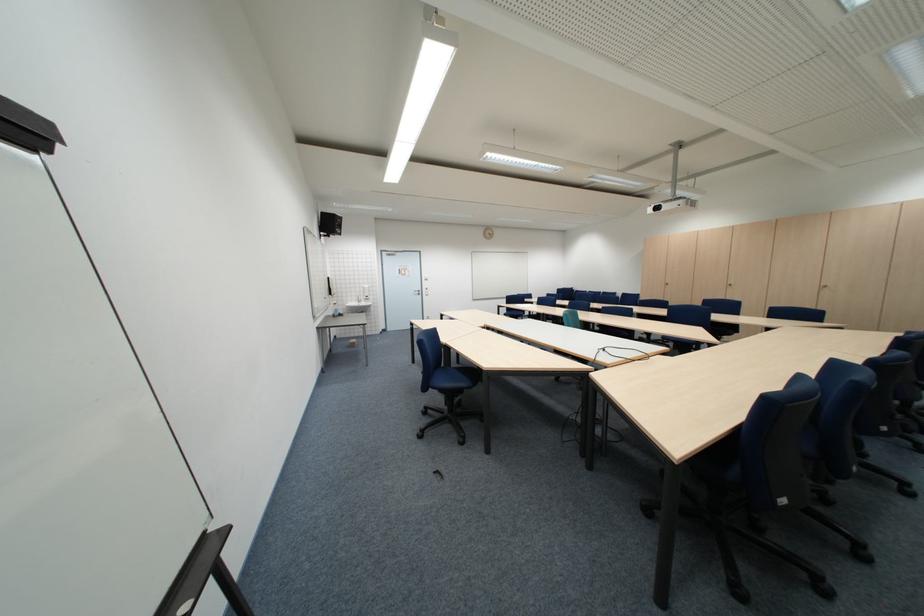
Describe the element at coordinates (362, 299) in the screenshot. I see `a faucet handle` at that location.